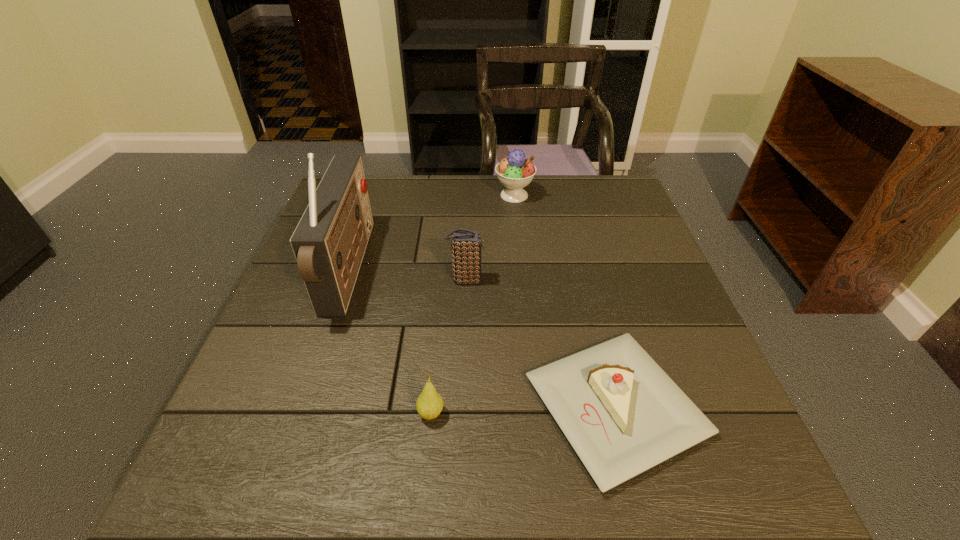
At what (x,y) coordinates should I click in order to perform the action: click on vacant region at the near left corner of the desktop. Please return your answer as a coordinate pair (x, y). This screenshot has height=540, width=960. Looking at the image, I should click on (211, 477).

Locate an element on the screen. vacant space at the far right corner is located at coordinates (588, 194).

Locate an element on the screen. Image resolution: width=960 pixels, height=540 pixels. free point at the near right corner is located at coordinates (677, 492).

The height and width of the screenshot is (540, 960). What are the coordinates of `vacant area that lies between the clutch bag and the second shortest object` in the screenshot? It's located at (448, 347).

Find the location of a particular element. The image size is (960, 540). vacant space in between the icecream and the clutch bag is located at coordinates (491, 238).

You are a GUI agent. You are given a task and a screenshot of the screen. Output one action in this format:
    pyautogui.click(x=<x>, y=<y>)
    Task: Click on the free area in between the clutch bag and the icecream
    
    Given the screenshot: What is the action you would take?
    pyautogui.click(x=491, y=238)

Where is `free point between the shortest object and the fourth tallest object`? This screenshot has height=540, width=960. free point between the shortest object and the fourth tallest object is located at coordinates (523, 410).

This screenshot has width=960, height=540. What are the coordinates of `blank region between the radio receiver and the farthest object` in the screenshot? It's located at (432, 233).

Locate an element on the screen. Image resolution: width=960 pixels, height=540 pixels. vacant point located between the farthest object and the second shortest object is located at coordinates (472, 305).

The height and width of the screenshot is (540, 960). What are the coordinates of `free spot between the pear and the farthest object` in the screenshot? It's located at (472, 305).